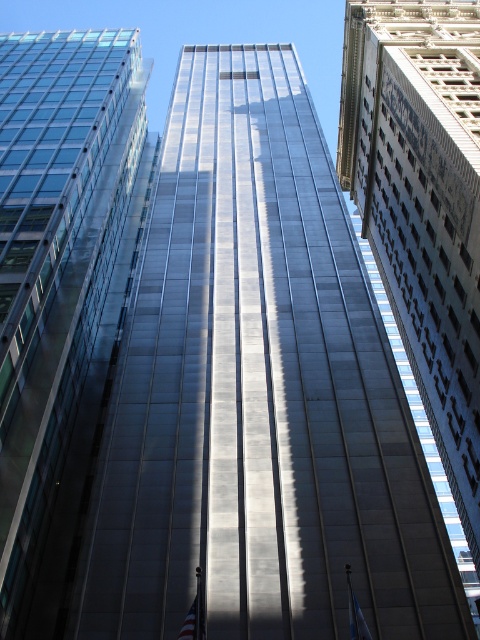
Question: Which object is farther from the camera taking this photo?

Choices:
 (A) reflective glass skyscraper at center
 (B) glassy reflective skyscraper at left

Answer: (A)

Question: Is glassy reflective skyscraper at left below reflective glass skyscraper at center?

Choices:
 (A) yes
 (B) no

Answer: (B)

Question: Can you confirm if reflective glass skyscraper at center is smaller than american flag at lower center?

Choices:
 (A) no
 (B) yes

Answer: (A)

Question: Does glassy reflective skyscraper at left appear on the right side of reflective glass skyscraper at center?

Choices:
 (A) no
 (B) yes

Answer: (A)

Question: Which is farther from the glassy reflective skyscraper at left?

Choices:
 (A) reflective glass skyscraper at center
 (B) american flag at lower center

Answer: (B)

Question: Which of the following is the closest to the observer?

Choices:
 (A) american flag at lower center
 (B) glassy reflective skyscraper at left
 (C) blue fabric flag at center

Answer: (C)